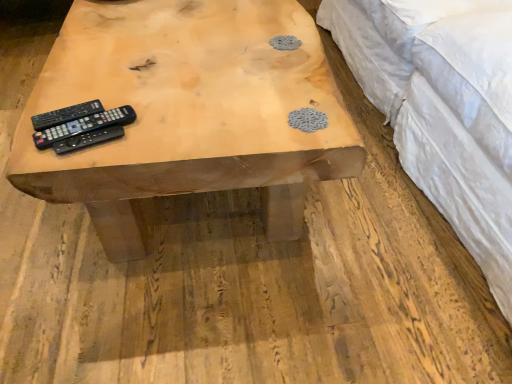
In order to click on vacant area on the back side of black plastic remote at left, which ranks as the 2th remote control in back-to-front order in this screenshot , I will do `click(110, 81)`.